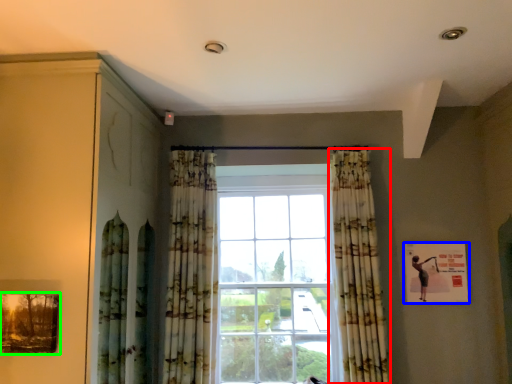
Question: Which is nearer to the curtain (highlighted by a red box)? picture frame (highlighted by a blue box) or picture frame (highlighted by a green box).

Choices:
 (A) picture frame
 (B) picture frame

Answer: (A)